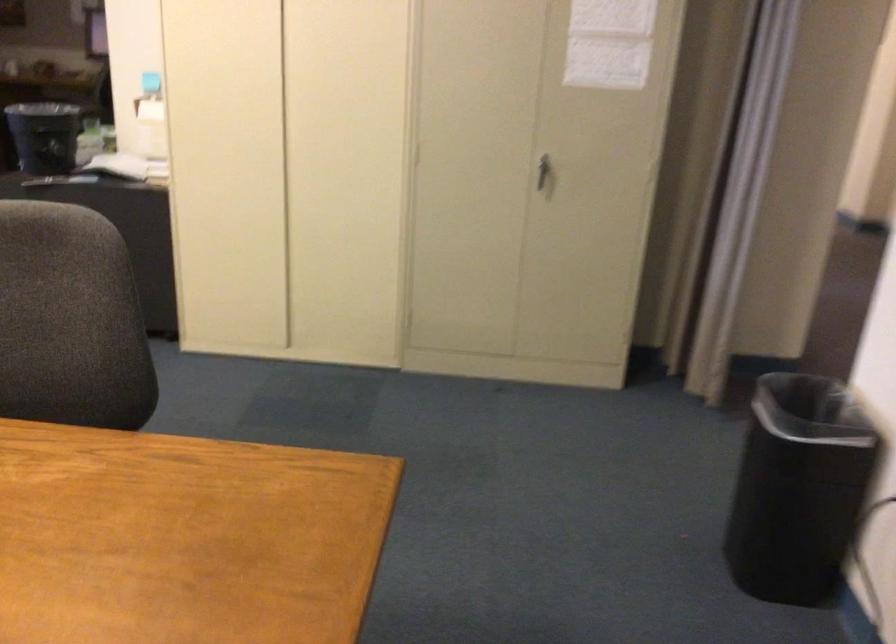
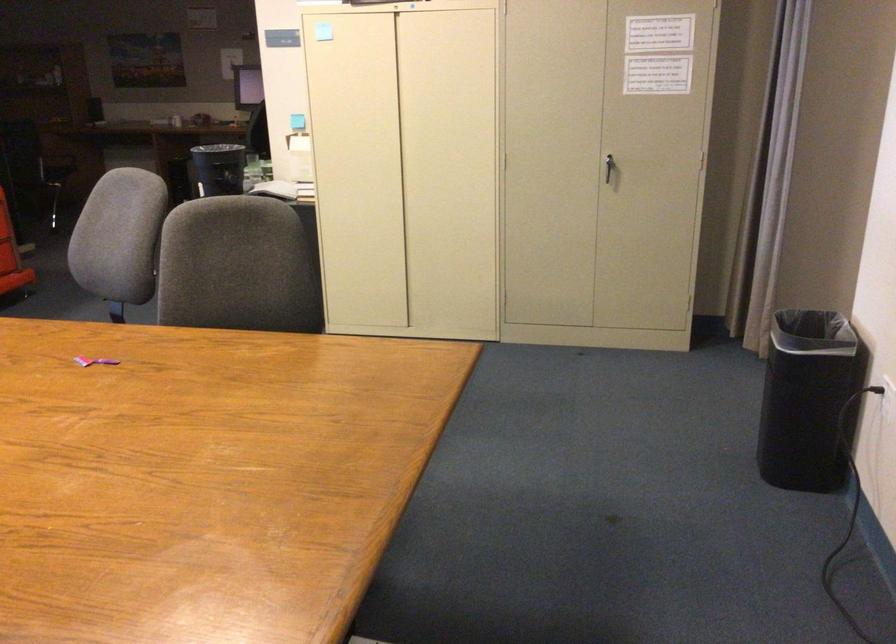
In the second image, find the point that corresponds to (x=541, y=175) in the first image.

(609, 169)